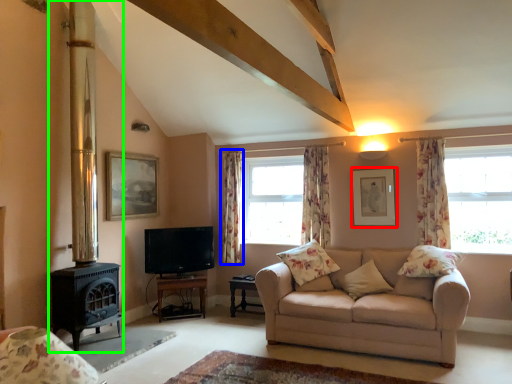
Question: Which object is positioned farthest from picture frame (highlighted by a red box)? Select from curtain (highlighted by a blue box) and fireplace (highlighted by a green box).

Choices:
 (A) curtain
 (B) fireplace

Answer: (B)